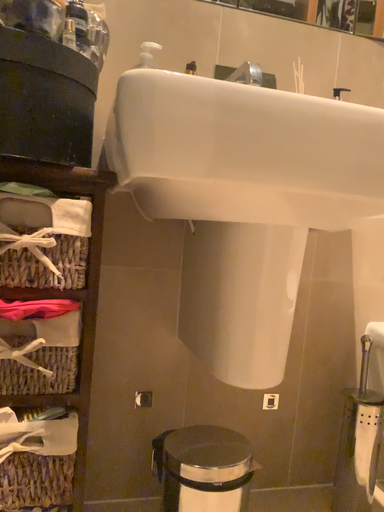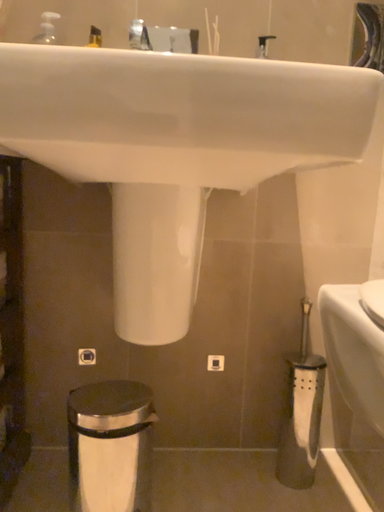
Question: How did the camera likely rotate when shooting the video?

Choices:
 (A) rotated left
 (B) rotated right

Answer: (A)